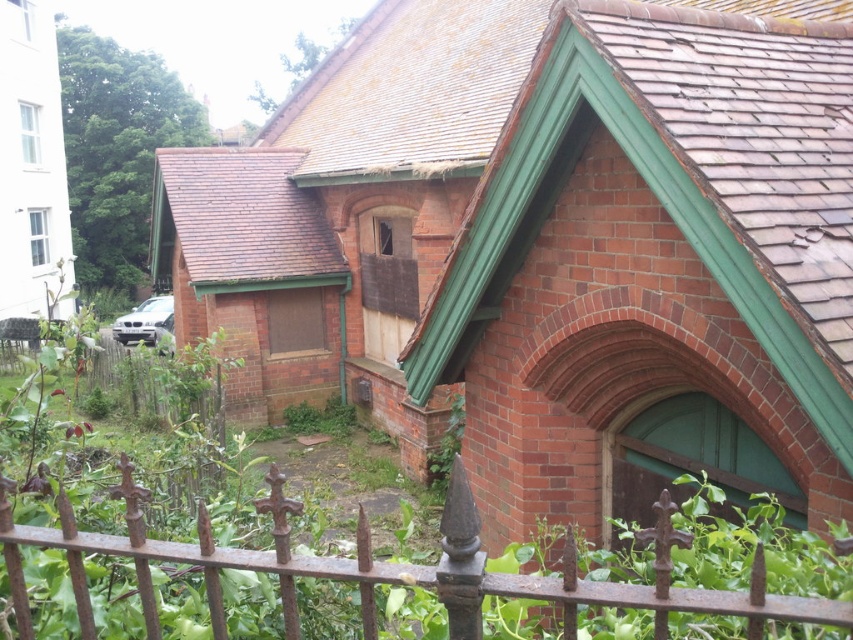
Question: Is rusty iron fence at lower center closer to camera compared to brown shingles at upper left?

Choices:
 (A) no
 (B) yes

Answer: (B)

Question: Which point appears farthest from the camera in this image?

Choices:
 (A) (207, 179)
 (B) (488, 124)
 (C) (735, 609)

Answer: (A)

Question: Which of the following is the farthest from the observer?

Choices:
 (A) (361, 604)
 (B) (811, 0)
 (C) (196, 227)

Answer: (C)

Question: Does brown shingles at upper center appear on the left side of brown shingles at upper left?

Choices:
 (A) no
 (B) yes

Answer: (A)

Question: Which point is closer to the camera taking this photo?

Choices:
 (A) (306, 212)
 (B) (726, 608)

Answer: (B)

Question: Does rusty iron fence at lower center appear on the left side of brown shingles at upper center?

Choices:
 (A) yes
 (B) no

Answer: (A)